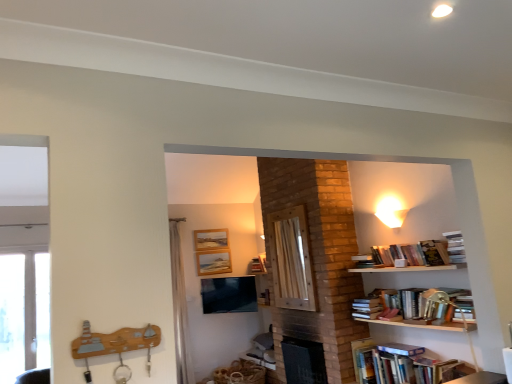
Question: Does matte black tv at center have a lesser height compared to hardcover books at lower right, marked as the 2th book in a top-to-bottom arrangement?

Choices:
 (A) no
 (B) yes

Answer: (A)

Question: From a real-world perspective, is matte black tv at center over hardcover books at lower right, marked as the 1th book in a bottom-to-top arrangement?

Choices:
 (A) no
 (B) yes

Answer: (B)

Question: Is matte black tv at center at the right side of hardcover books at lower right, marked as the 2th book in a top-to-bottom arrangement?

Choices:
 (A) no
 (B) yes

Answer: (A)

Question: Is matte black tv at center bigger than hardcover books at lower right, marked as the 2th book in a top-to-bottom arrangement?

Choices:
 (A) yes
 (B) no

Answer: (B)

Question: Are matte black tv at center and hardcover books at lower right, marked as the 1th book in a bottom-to-top arrangement, far apart?

Choices:
 (A) yes
 (B) no

Answer: (A)

Question: Considering their positions, is matte black tv at center located in front of or behind hardcover books at upper right, acting as the second book starting from the bottom?

Choices:
 (A) front
 (B) behind

Answer: (B)

Question: Considering the positions of matte black tv at center and hardcover books at upper right, acting as the second book starting from the bottom, in the image, is matte black tv at center wider or thinner than hardcover books at upper right, acting as the second book starting from the bottom,?

Choices:
 (A) wide
 (B) thin

Answer: (B)

Question: Do you think matte black tv at center is within hardcover books at upper right, acting as the 1th book starting from the top, or outside of it?

Choices:
 (A) inside
 (B) outside

Answer: (B)

Question: From a real-world perspective, is matte black tv at center above or below hardcover books at upper right, acting as the 1th book starting from the top?

Choices:
 (A) below
 (B) above

Answer: (A)

Question: Looking at the image, does transparent glass door at left seem bigger or smaller compared to wooden picture frame at upper center, marked as the second picture frame in a top-to-bottom arrangement?

Choices:
 (A) big
 (B) small

Answer: (A)

Question: From their relative heights in the image, would you say transparent glass door at left is taller or shorter than wooden picture frame at upper center, the 1th picture frame in the bottom-to-top sequence?

Choices:
 (A) tall
 (B) short

Answer: (A)

Question: From the image's perspective, is transparent glass door at left above or below wooden picture frame at upper center, marked as the second picture frame in a top-to-bottom arrangement?

Choices:
 (A) above
 (B) below

Answer: (B)

Question: Is transparent glass door at left to the left or to the right of wooden picture frame at upper center, the 1th picture frame in the bottom-to-top sequence, in the image?

Choices:
 (A) left
 (B) right

Answer: (A)

Question: From a real-world perspective, relative to wooden screen door at center, is transparent glass door at left vertically above or below?

Choices:
 (A) above
 (B) below

Answer: (B)

Question: From the image's perspective, is transparent glass door at left positioned above or below wooden screen door at center?

Choices:
 (A) above
 (B) below

Answer: (B)